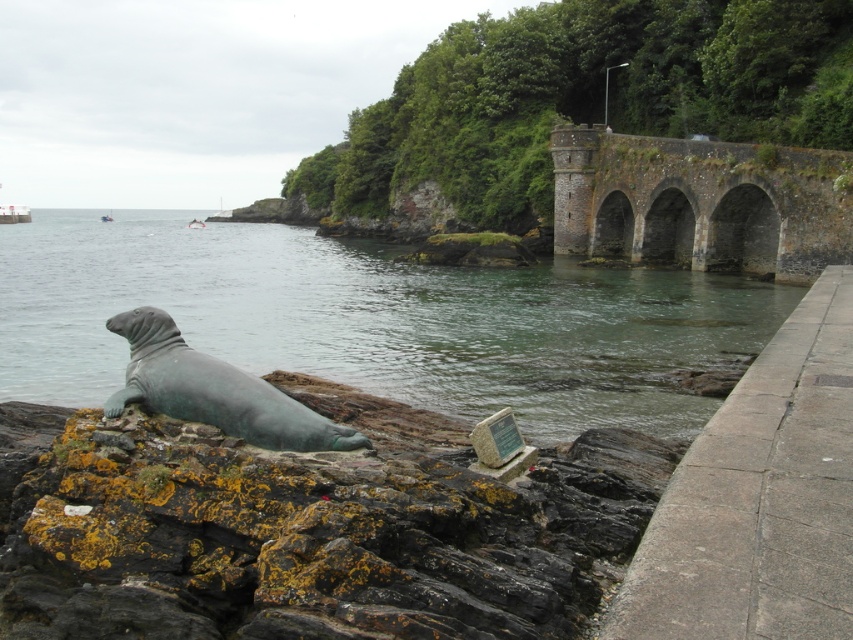
You are a tour guide leading a group to the brown stone bridge at upper right from the green patina statue at lower left. The group has a 50 meter walking limit. Can you safely lead them to the bridge without exceeding the limit?

The distance between the brown stone bridge at upper right and the green patina statue at lower left is 33.04 meters, so yes, the group can safely walk to the bridge without exceeding the 50 meter limit.

You are standing at the statue of a seal on the rocky outcrop. Looking out, you notice a point marked at coordinates (699, 204). What structure does this point indicate?

The point at coordinates (699, 204) corresponds to the brown stone bridge at upper right.

You are a photographer planning to capture the greenish water at lower left and the green patina statue at lower left in a single frame. Based on their sizes, which one will occupy more of the frame?

The greenish water at lower left is larger in size than the green patina statue at lower left, so it will occupy more of the frame.